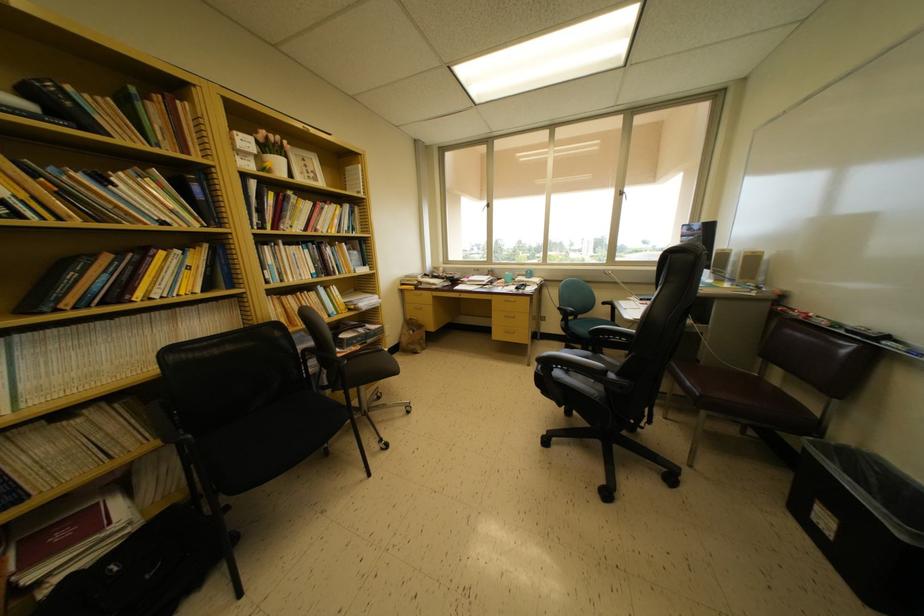
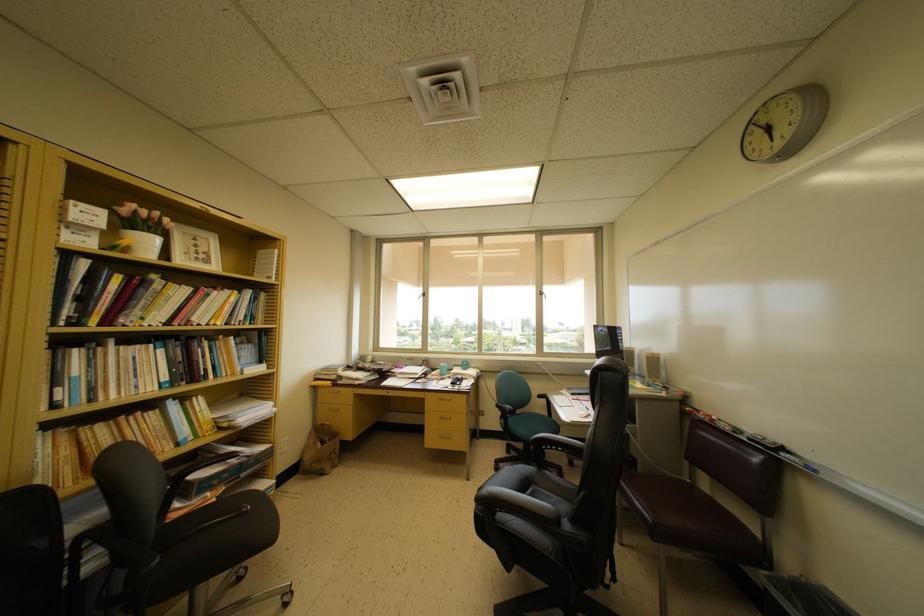
In the second image, find the point that corresponds to point (326, 214) in the first image.

(213, 300)